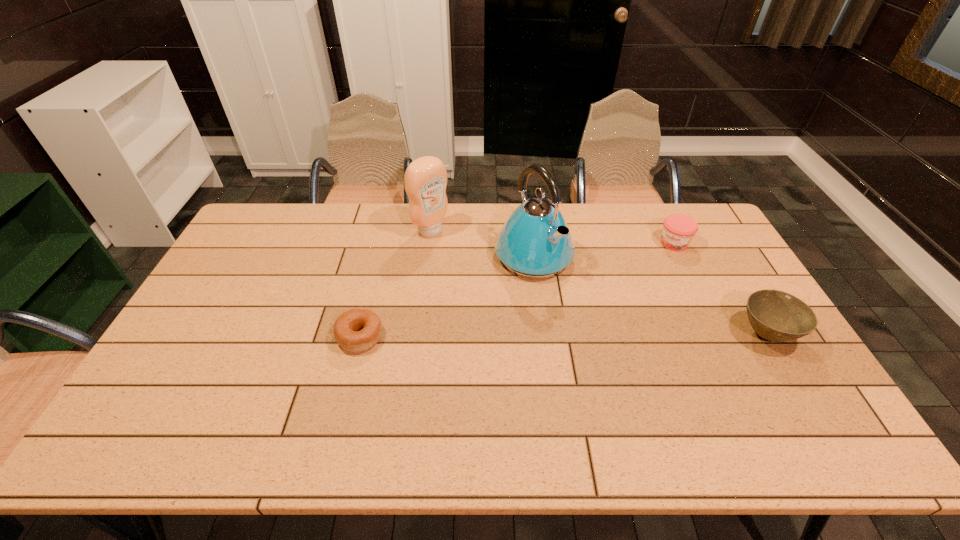
This screenshot has width=960, height=540. In order to click on free spot located on the front label of the jam in this screenshot , I will do `click(652, 276)`.

The width and height of the screenshot is (960, 540). In order to click on free space located 0.190m on the front label of the jam in this screenshot , I will do `click(647, 284)`.

Locate an element on the screen. This screenshot has height=540, width=960. vacant space located on the front label of the jam is located at coordinates (636, 300).

In order to click on free region located 0.080m at the spout of the third object from left to right in this screenshot , I will do `click(574, 295)`.

The width and height of the screenshot is (960, 540). What are the coordinates of `free space located at the spout of the third object from left to right` in the screenshot? It's located at (642, 359).

Where is `free space located at the spout of the third object from left to right`? free space located at the spout of the third object from left to right is located at coordinates (589, 309).

This screenshot has height=540, width=960. Find the location of `vacant space situated on the label of the second tallest object`. vacant space situated on the label of the second tallest object is located at coordinates (516, 296).

Find the location of a particular element. The height and width of the screenshot is (540, 960). free space located on the label of the second tallest object is located at coordinates (477, 267).

Where is `vacant region located 0.250m on the label of the second tallest object`? vacant region located 0.250m on the label of the second tallest object is located at coordinates (490, 276).

At what (x,y) coordinates should I click in order to perform the action: click on jam situated at the far edge. Please return your answer as a coordinate pair (x, y). This screenshot has width=960, height=540. Looking at the image, I should click on (678, 230).